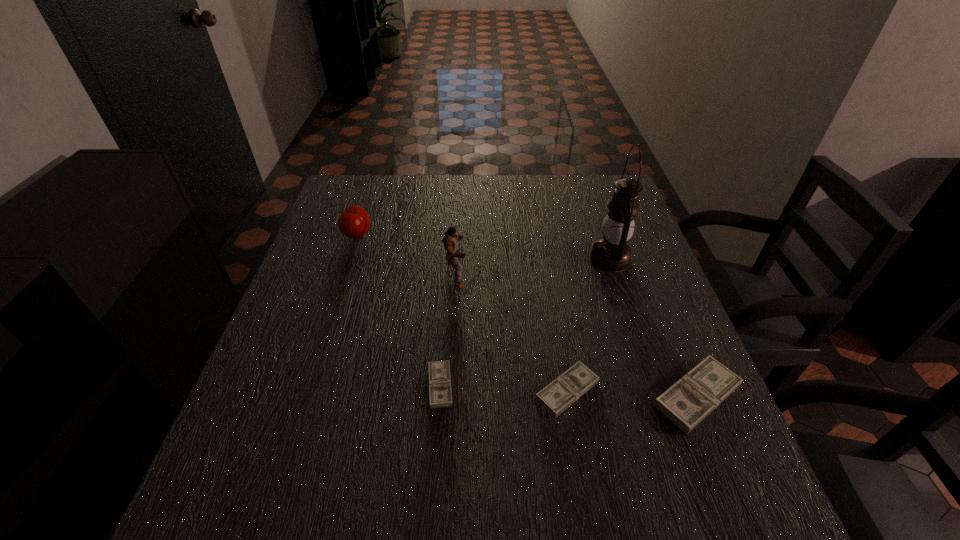
Locate an element on the screen. The width and height of the screenshot is (960, 540). free region that satisfies the following two spatial constraints: 1. on the front-facing side of the second tallest object; 2. on the back side of the second money from left to right is located at coordinates (450, 390).

This screenshot has height=540, width=960. I want to click on blank space that satisfies the following two spatial constraints: 1. on the front-facing side of the third object from right to left; 2. on the left side of the puncher, so click(450, 390).